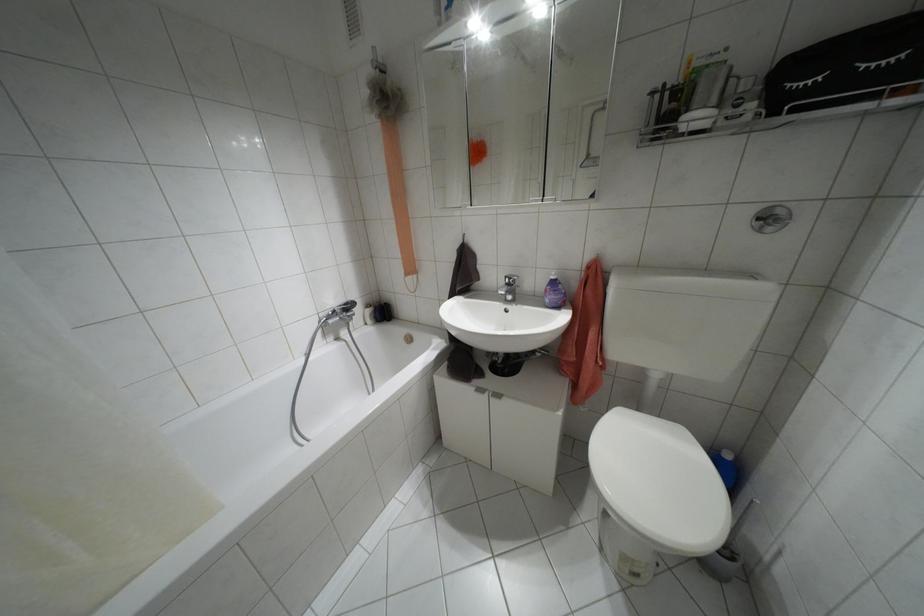
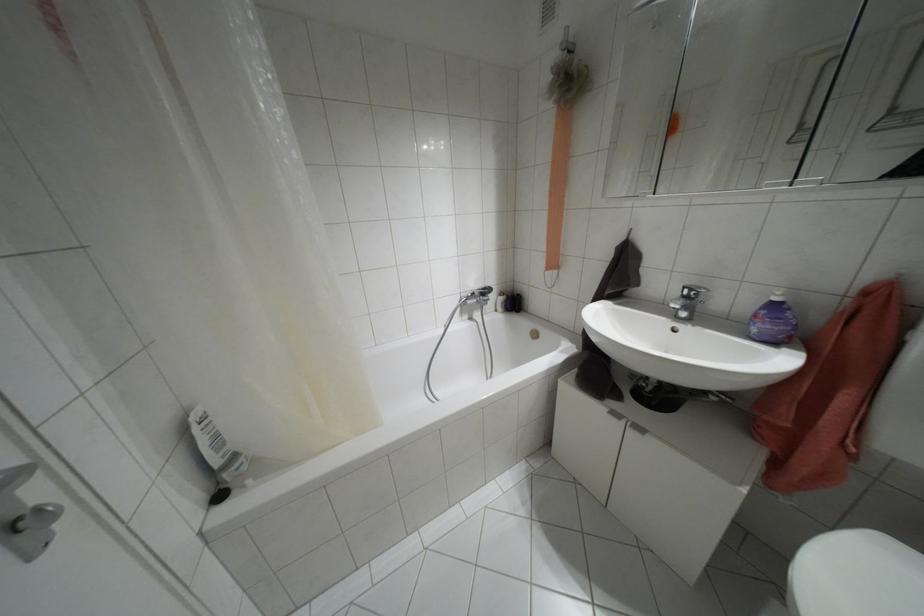
Question: The first image is from the beginning of the video and the second image is from the end. How did the camera likely rotate when shooting the video?

Choices:
 (A) Left
 (B) Right
 (C) Up
 (D) Down

Answer: (A)